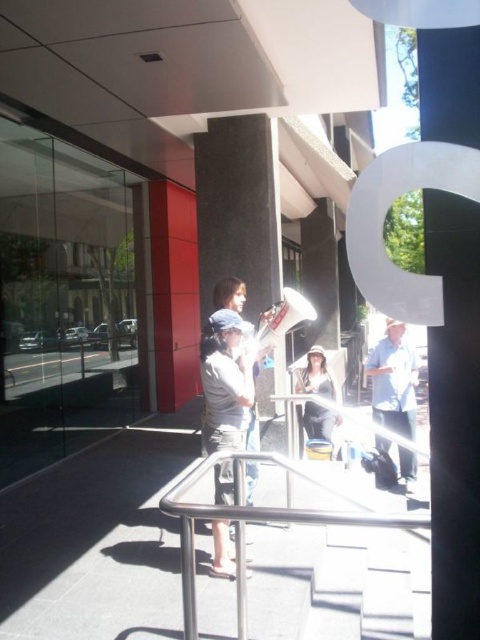
Does point (219, 195) come behind point (229, 493)?

That is True.

Who is more distant from viewer, (266, 234) or (214, 429)?

Positioned behind is point (266, 234).

The width and height of the screenshot is (480, 640). What do you see at coordinates (239, 209) in the screenshot? I see `black polished stone pillar at center` at bounding box center [239, 209].

Locate an element on the screen. This screenshot has height=640, width=480. black polished stone pillar at center is located at coordinates (239, 209).

Consider the image. Does black polished stone pillar at center appear over light blue denim shirt at center?

Indeed, black polished stone pillar at center is positioned over light blue denim shirt at center.

Who is more distant from viewer, [201,257] or [393,348]?

Positioned behind is point [393,348].

This screenshot has width=480, height=640. Find the location of `black polished stone pillar at center`. black polished stone pillar at center is located at coordinates pos(239,209).

Is denim jacket at center below matte black hat at center?

No, denim jacket at center is not below matte black hat at center.

Which of these two, denim jacket at center or matte black hat at center, stands shorter?

matte black hat at center is shorter.

Locate an element on the screen. denim jacket at center is located at coordinates (227, 380).